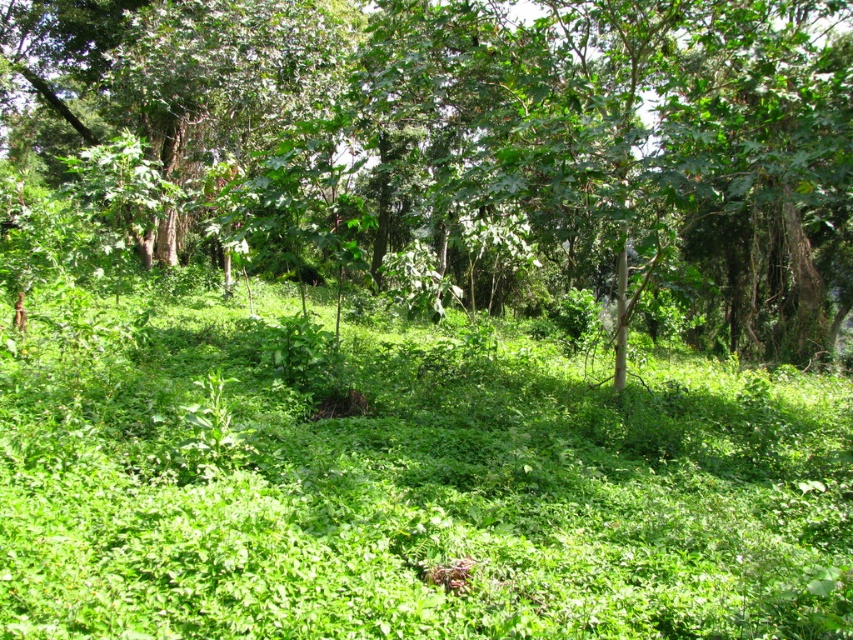
Question: Which point is closer to the camera taking this photo?

Choices:
 (A) (850, 586)
 (B) (801, 356)

Answer: (A)

Question: Can you confirm if green leafy grass at center is positioned to the right of green leafy tree at center?

Choices:
 (A) yes
 (B) no

Answer: (B)

Question: Can you confirm if green leafy grass at center is bigger than green leafy tree at center?

Choices:
 (A) no
 (B) yes

Answer: (A)

Question: Observing the image, what is the correct spatial positioning of green leafy grass at center in reference to green leafy tree at center?

Choices:
 (A) above
 (B) below

Answer: (B)